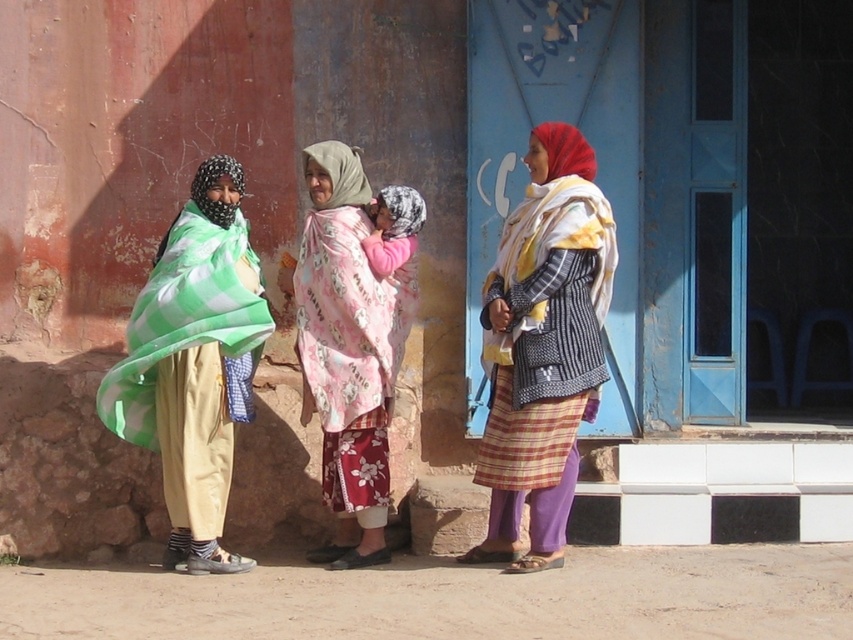
Between point (550, 458) and point (323, 202), which one is positioned in front?

Positioned in front is point (550, 458).

Is striped woolen sweater at center taller than pink floral scarf at center?

Correct, striped woolen sweater at center is much taller as pink floral scarf at center.

Does point (490, 314) lie behind point (328, 230)?

No, it is in front of (328, 230).

Locate an element on the screen. The width and height of the screenshot is (853, 640). striped woolen sweater at center is located at coordinates (543, 346).

From the picture: Does green checkered scarf at left appear over pink floral scarf at center?

Incorrect, green checkered scarf at left is not positioned above pink floral scarf at center.

Between green checkered scarf at left and pink floral scarf at center, which one appears on the right side from the viewer's perspective?

pink floral scarf at center is more to the right.

The width and height of the screenshot is (853, 640). Describe the element at coordinates (194, 362) in the screenshot. I see `green checkered scarf at left` at that location.

Locate an element on the screen. The width and height of the screenshot is (853, 640). green checkered scarf at left is located at coordinates (194, 362).

Is striped woolen sweater at center to the right of green checkered scarf at left from the viewer's perspective?

Yes, striped woolen sweater at center is to the right of green checkered scarf at left.

Does point (552, 164) come behind point (218, 296)?

Yes, point (552, 164) is farther from viewer.

Find the location of `striped woolen sweater at center`. striped woolen sweater at center is located at coordinates (543, 346).